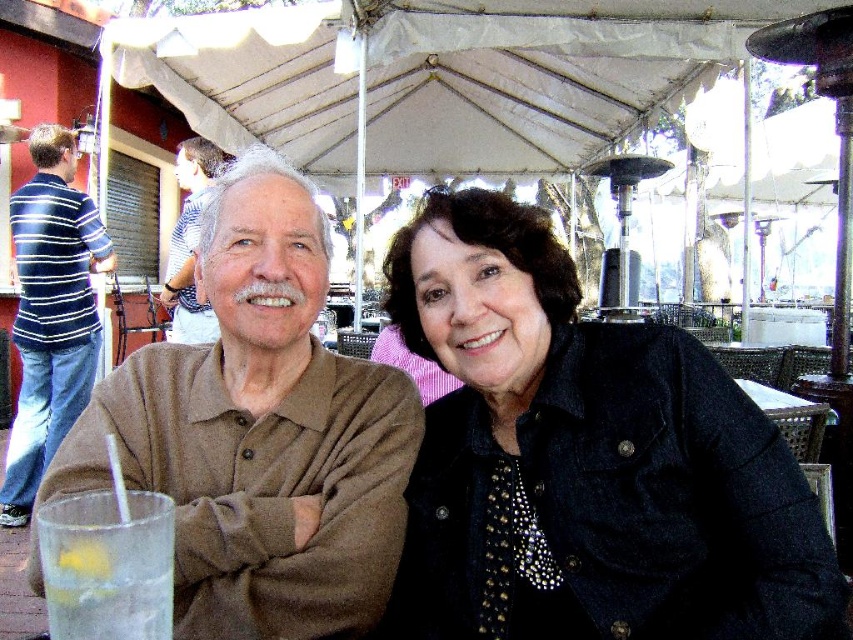
Question: Which of these objects is positioned closest to the striped cotton shirt at left?

Choices:
 (A) striped cotton shirt at upper left
 (B) clear glass at lower left
 (C) brown cotton shirt at center
 (D) black denim jacket at center

Answer: (A)

Question: Can you confirm if black denim jacket at center is thinner than clear glass at lower left?

Choices:
 (A) no
 (B) yes

Answer: (A)

Question: Which is farther from the brown cotton shirt at center?

Choices:
 (A) clear glass at lower left
 (B) striped cotton shirt at left
 (C) striped cotton shirt at upper left
 (D) black denim jacket at center

Answer: (B)

Question: Which of the following is the farthest from the observer?

Choices:
 (A) (602, 604)
 (B) (178, 280)
 (C) (71, 156)

Answer: (C)

Question: Is the position of black denim jacket at center less distant than that of clear glass at lower left?

Choices:
 (A) yes
 (B) no

Answer: (B)

Question: Considering the relative positions of clear glass at lower left and striped cotton shirt at upper left in the image provided, where is clear glass at lower left located with respect to striped cotton shirt at upper left?

Choices:
 (A) left
 (B) right

Answer: (B)